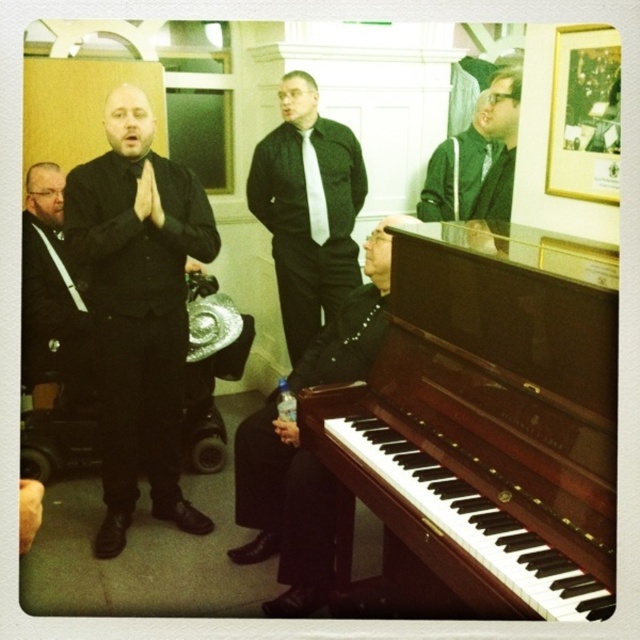
You are standing in the room and want to move from the point at coordinates [360,156] to the point at coordinates [508,72]. Which direction should you move to get closer to the latter?

You should move backward because point [360,156] is closer to the camera than point [508,72], so moving backward will bring you closer to point [508,72].

You are organizing a photo shoot and need to position two subjects wearing the matte black suit at left and the green matte jacket at upper right. According to the scene, how far apart should these two subjects be placed?

The matte black suit at left and the green matte jacket at upper right should be placed 6.88 feet apart from each other, as per the scene description.

You are an event photographer at a formal gathering and need to capture a photo of both the matte black suit at center and the matte black suit at left. Based on their positions, which one is located to the right of the other?

The matte black suit at center is positioned on the right side of the matte black suit at left, so the matte black suit at center is to the right of the matte black suit at left.